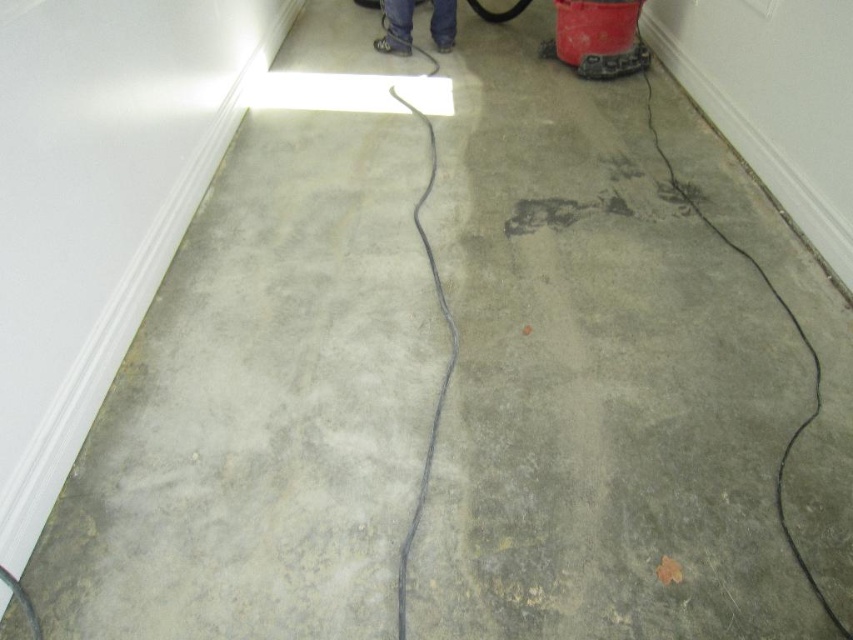
Question: Is gray concrete crack at lower right bigger than matte black shoes at center?

Choices:
 (A) no
 (B) yes

Answer: (B)

Question: Can you confirm if gray concrete crack at lower right is positioned to the left of matte black shoes at center?

Choices:
 (A) yes
 (B) no

Answer: (B)

Question: Which object appears closest to the camera in this image?

Choices:
 (A) matte black shoes at center
 (B) gray concrete crack at lower right

Answer: (B)

Question: Which point is closer to the camera?

Choices:
 (A) matte black shoes at center
 (B) gray concrete crack at lower right

Answer: (B)

Question: Can you confirm if gray concrete crack at lower right is thinner than matte black shoes at center?

Choices:
 (A) no
 (B) yes

Answer: (B)